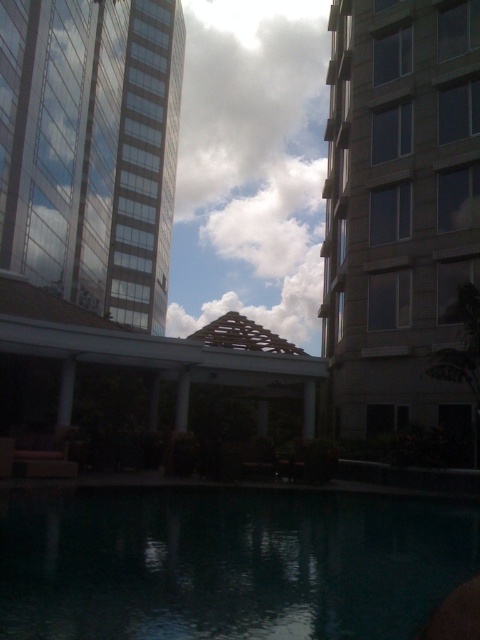
Is gray concrete building at right closer to the viewer compared to white fluffy cloud at upper center?

Yes.

Does gray concrete building at right appear over white fluffy cloud at upper center?

Incorrect, gray concrete building at right is not positioned above white fluffy cloud at upper center.

Which is behind, point (355, 435) or point (303, 200)?

Positioned behind is point (303, 200).

At what (x,y) coordinates should I click in order to perform the action: click on gray concrete building at right. Please return your answer as a coordinate pair (x, y). The height and width of the screenshot is (640, 480). Looking at the image, I should click on (399, 211).

Which of these two, glassy reflective building at upper left or cloudy sky at center, stands taller?

cloudy sky at center is taller.

What do you see at coordinates (91, 148) in the screenshot? The image size is (480, 640). I see `glassy reflective building at upper left` at bounding box center [91, 148].

At what (x,y) coordinates should I click in order to perform the action: click on glassy reflective building at upper left. Please return your answer as a coordinate pair (x, y). Image resolution: width=480 pixels, height=640 pixels. Looking at the image, I should click on (91, 148).

Which is behind, point (460, 1) or point (214, 193)?

The point (214, 193) is more distant.

Is gray concrete building at right smaller than cloudy sky at center?

Indeed, gray concrete building at right has a smaller size compared to cloudy sky at center.

Is point (331, 173) positioned before point (276, 13)?

Yes.

Find the location of `gray concrete building at right`. gray concrete building at right is located at coordinates (399, 211).